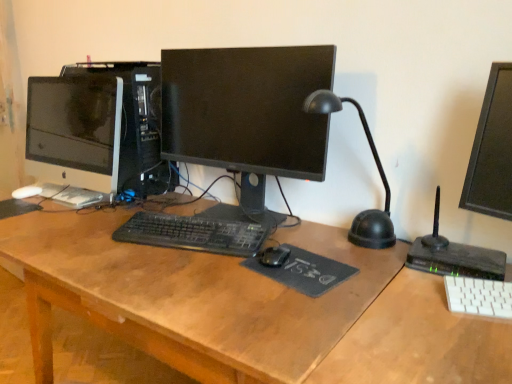
At what (x,y) coordinates should I click in order to perform the action: click on space that is in front of black plastic desk lamp at center right. Please return your answer as a coordinate pair (x, y). Looking at the image, I should click on (373, 281).